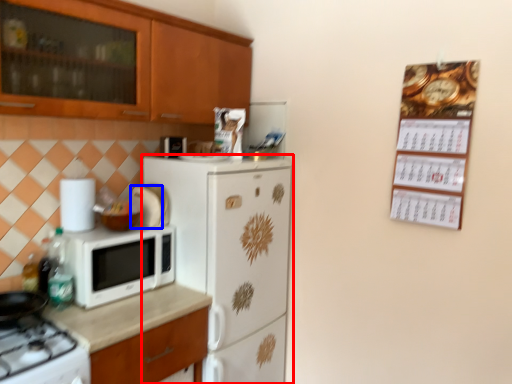
Question: Which point is closer to the camera, refrigerator (highlighted by a red box) or appliance (highlighted by a blue box)?

Choices:
 (A) refrigerator
 (B) appliance

Answer: (A)